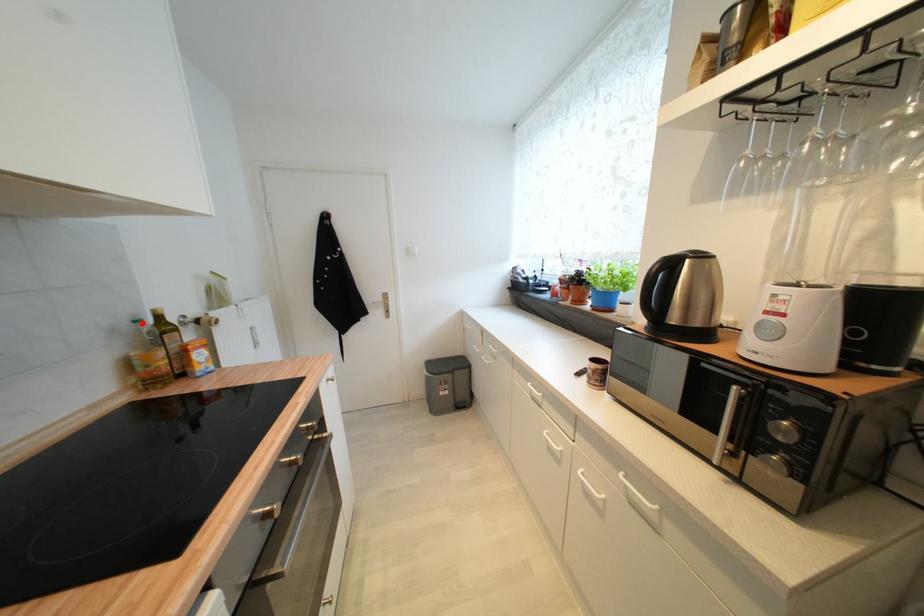
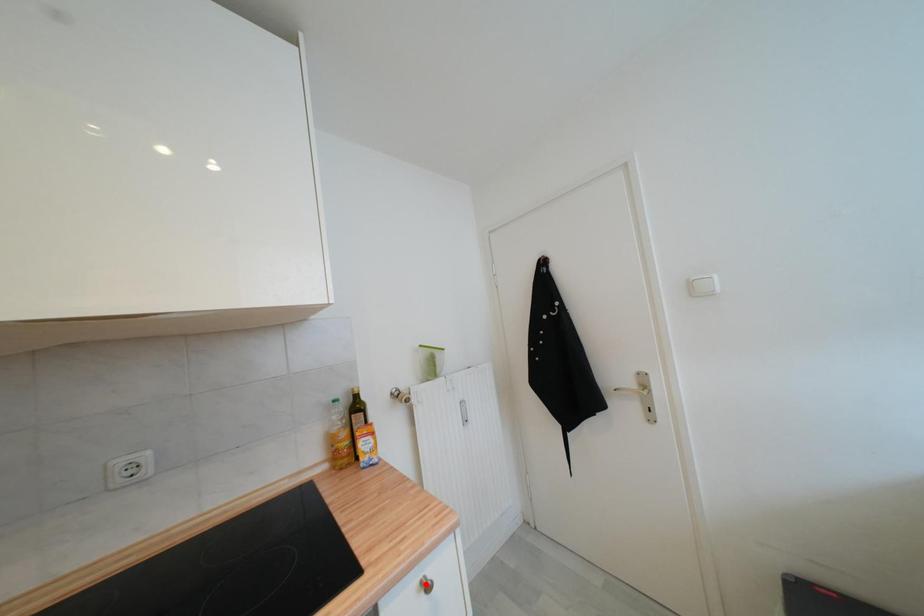
I am providing you with two images of the same scene from different viewpoints. A red point is marked on the first image and another point is marked on the second image. Are the points marked in image1 and image2 representing the same 3D position?

No